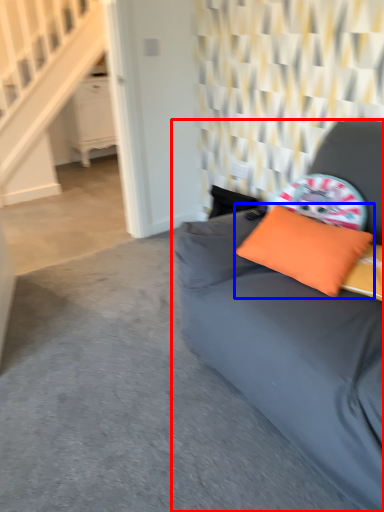
Question: Which point is further to the camera, studio couch (highlighted by a red box) or pillow (highlighted by a blue box)?

Choices:
 (A) studio couch
 (B) pillow

Answer: (B)